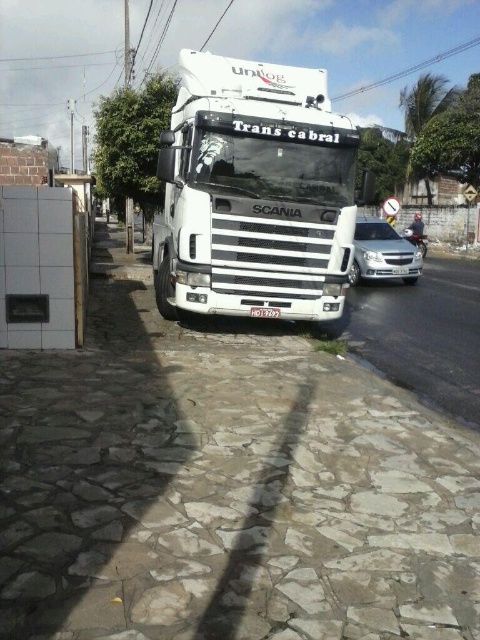
Question: From the image, what is the correct spatial relationship of white matte truck at center in relation to silver metallic sedan at right?

Choices:
 (A) above
 (B) below

Answer: (B)

Question: Where is white matte truck at center located in relation to silver metallic sedan at right in the image?

Choices:
 (A) left
 (B) right

Answer: (A)

Question: Which object is the farthest from the white plastic license plate at center?

Choices:
 (A) white matte truck at center
 (B) silver metallic sedan at right

Answer: (B)

Question: Which of these objects is positioned closest to the white plastic license plate at center?

Choices:
 (A) white matte truck at center
 (B) silver metallic sedan at right

Answer: (A)

Question: Estimate the real-world distances between objects in this image. Which object is closer to the white matte truck at center?

Choices:
 (A) silver metallic sedan at right
 (B) white plastic license plate at center

Answer: (B)

Question: Can you confirm if white matte truck at center is wider than white plastic license plate at center?

Choices:
 (A) no
 (B) yes

Answer: (B)